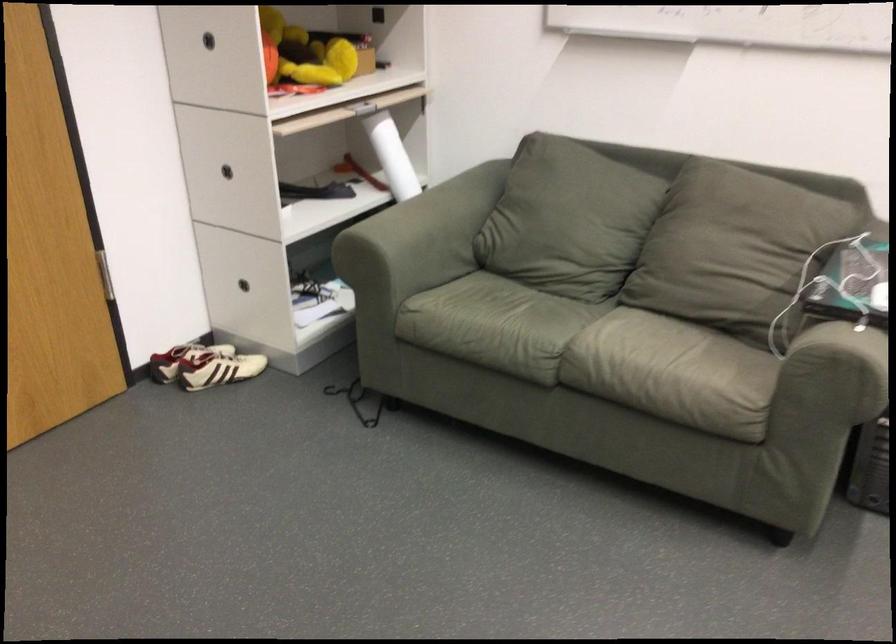
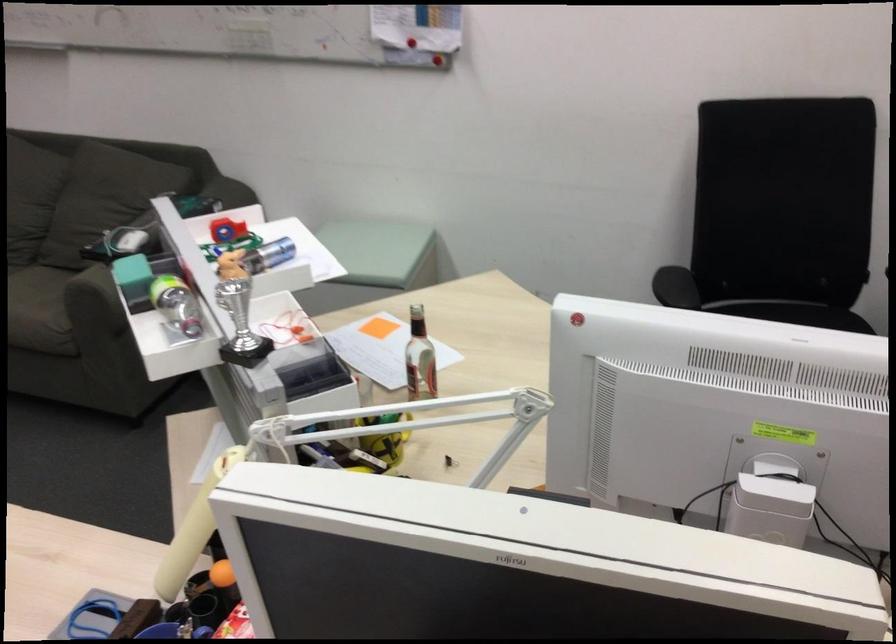
Where in the second image is the point corresponding to (631,353) from the first image?

(39, 308)